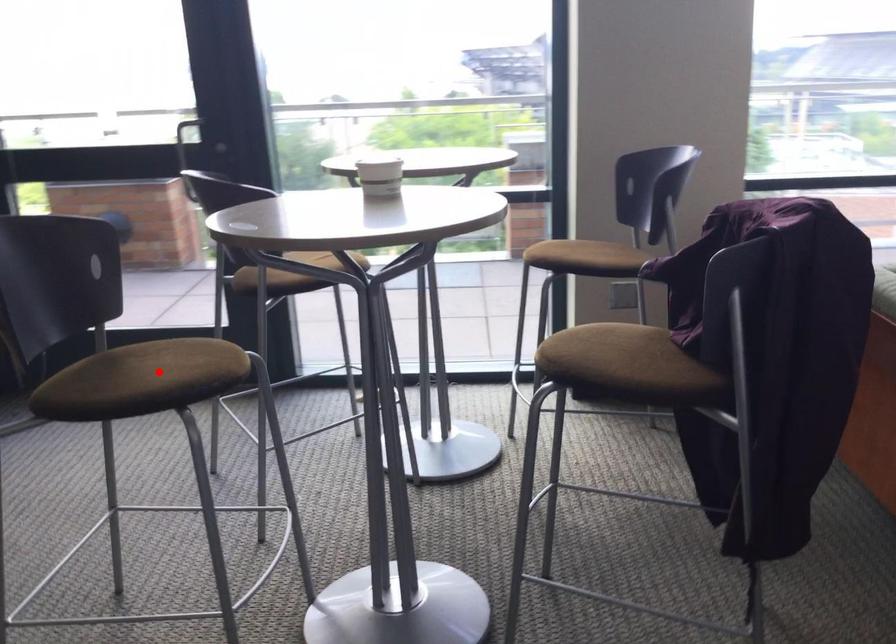
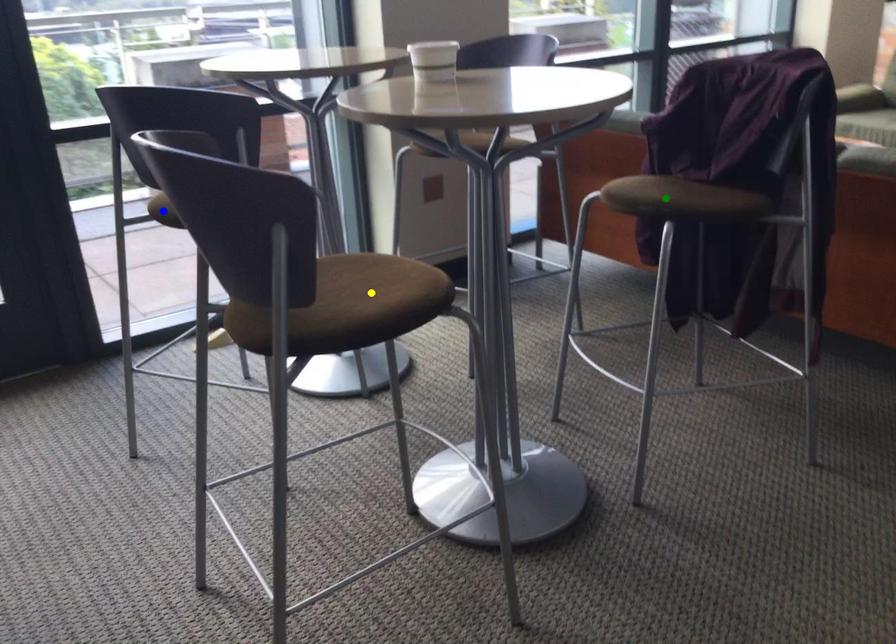
Question: I am providing you with two images of the same scene from different viewpoints. A red point is marked on the first image. You are given multiple points on the second image. Which mark in image 2 goes with the point in image 1?

Choices:
 (A) yellow point
 (B) blue point
 (C) green point

Answer: (A)